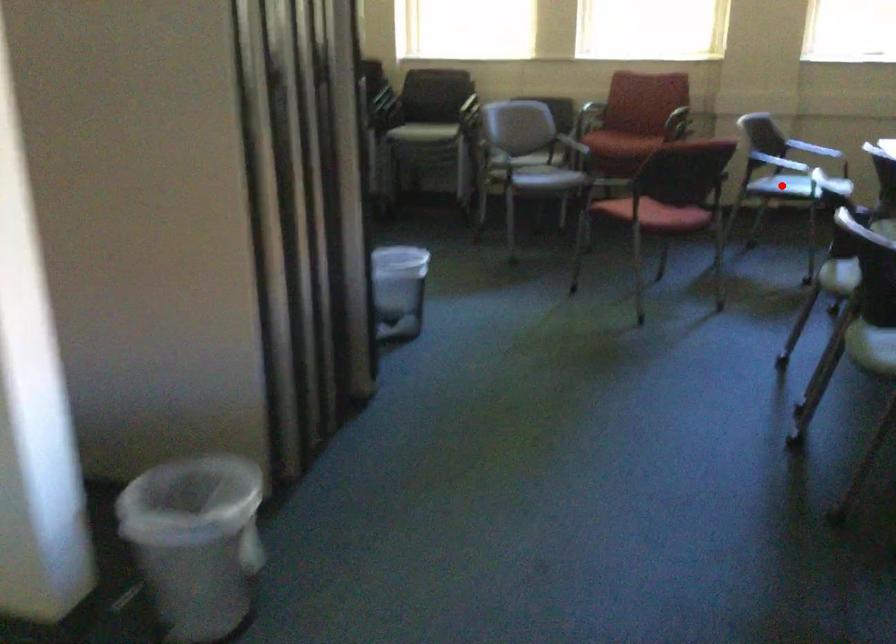
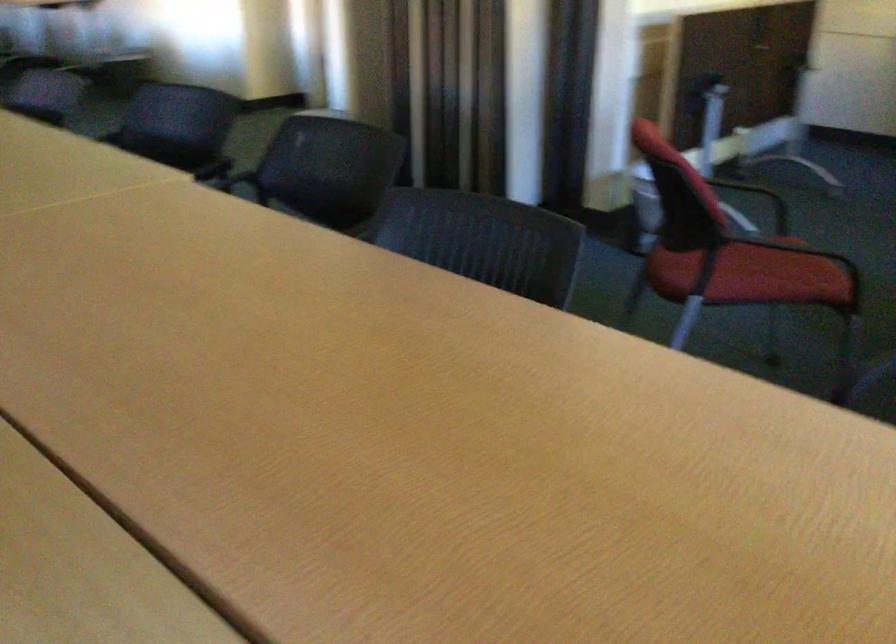
Question: I am providing you with two images of the same scene from different viewpoints. A red point is marked on the first image. Is the red point's position out of view in image 2?

Choices:
 (A) Yes
 (B) No

Answer: (A)